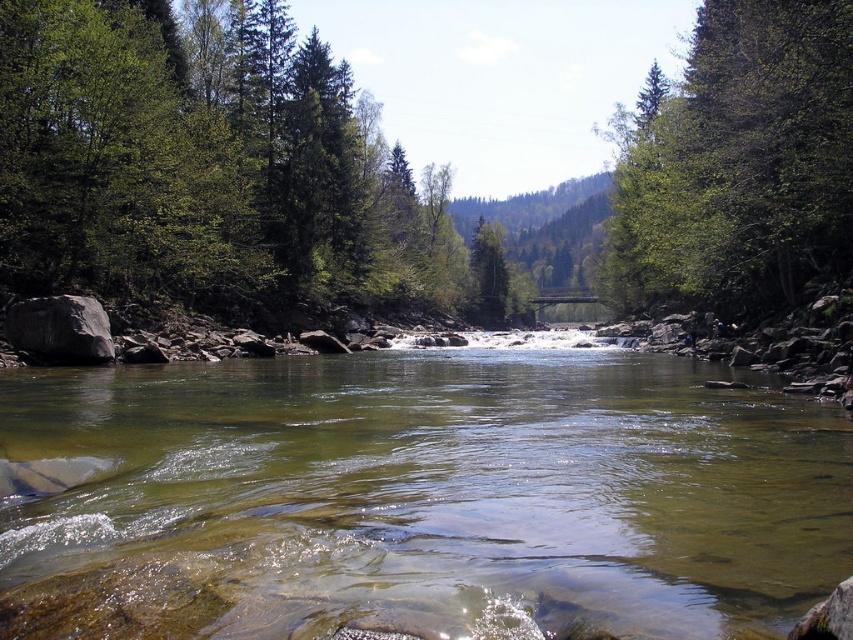
Question: Is green leafy tree at upper left behind gray smooth rock at left?

Choices:
 (A) no
 (B) yes

Answer: (B)

Question: Which point is farther to the camera?

Choices:
 (A) green leafy tree at upper left
 (B) gray smooth rock at left
 (C) green leafy tree at upper right

Answer: (A)

Question: Among these objects, which one is nearest to the camera?

Choices:
 (A) gray smooth rock at left
 (B) clear water at center
 (C) green leafy tree at upper right

Answer: (B)

Question: Which object appears closest to the camera in this image?

Choices:
 (A) green leafy tree at upper right
 (B) green leafy tree at upper left
 (C) clear water at center
 (D) gray smooth rock at left

Answer: (C)

Question: Does green leafy tree at upper left appear under green leafy tree at upper right?

Choices:
 (A) no
 (B) yes

Answer: (A)

Question: Can you confirm if green leafy tree at upper left is wider than gray smooth rock at left?

Choices:
 (A) yes
 (B) no

Answer: (A)